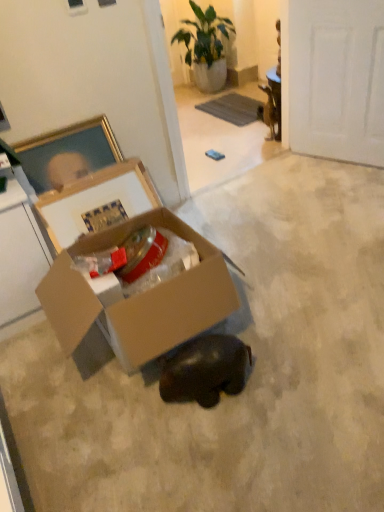
Identify the location of vacant area situated to the left side of shiny black elephant at center. The image size is (384, 512). (134, 415).